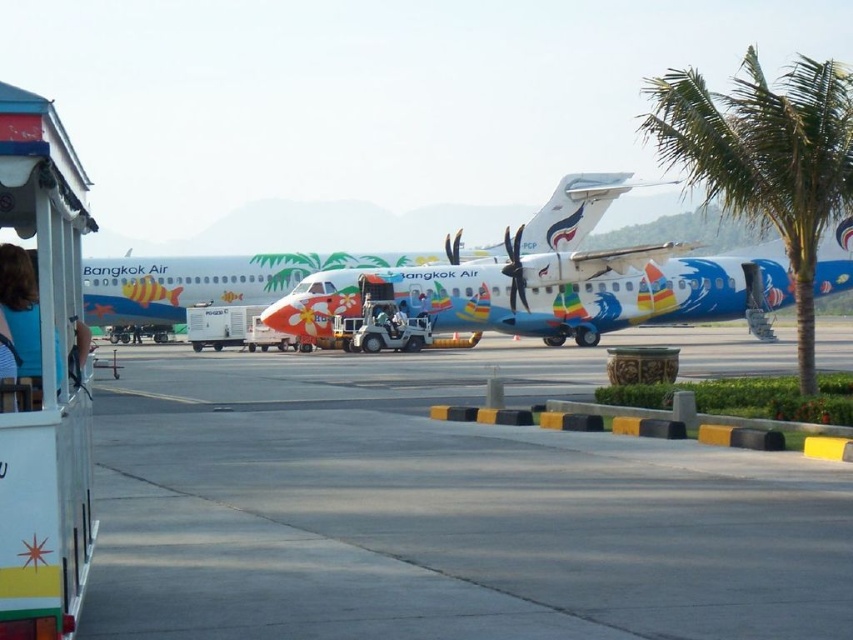
You are a maintenance worker needing to place a 2x2 meter equipment container on the smooth concrete tarmac at center. The painted aluminum airplane at center is currently occupying part of the tarmac. Can you fit the container on the remaining space?

The smooth concrete tarmac at center is smaller than the painted aluminum airplane at center, so there might not be enough space to fit the 2x2 meter equipment container on the remaining area.

Consider the image. You are a traveler waiting at the airport and see the green leafy palm tree at right and the blue striped shirt at left. Which object is bigger in size?

The green leafy palm tree at right has a larger size compared to the blue striped shirt at left.